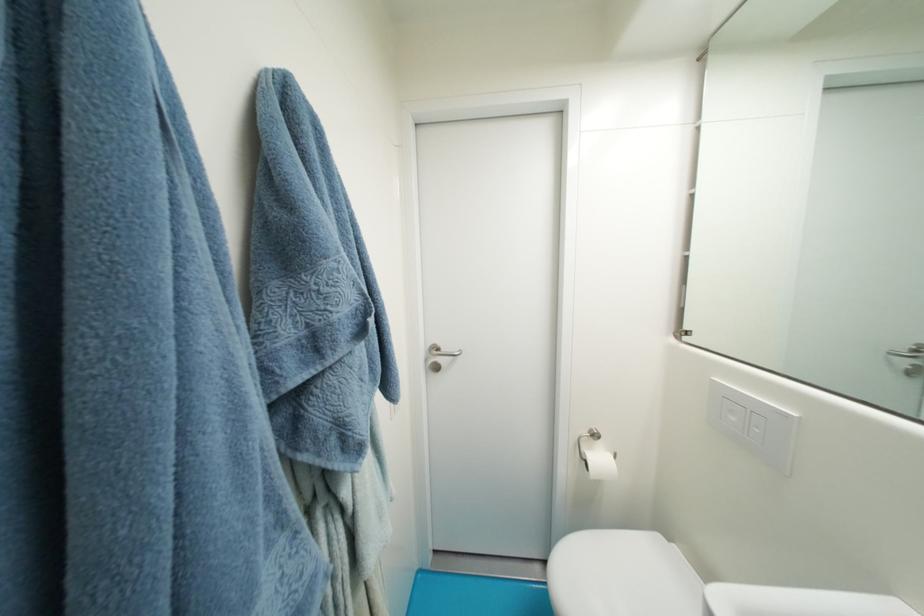
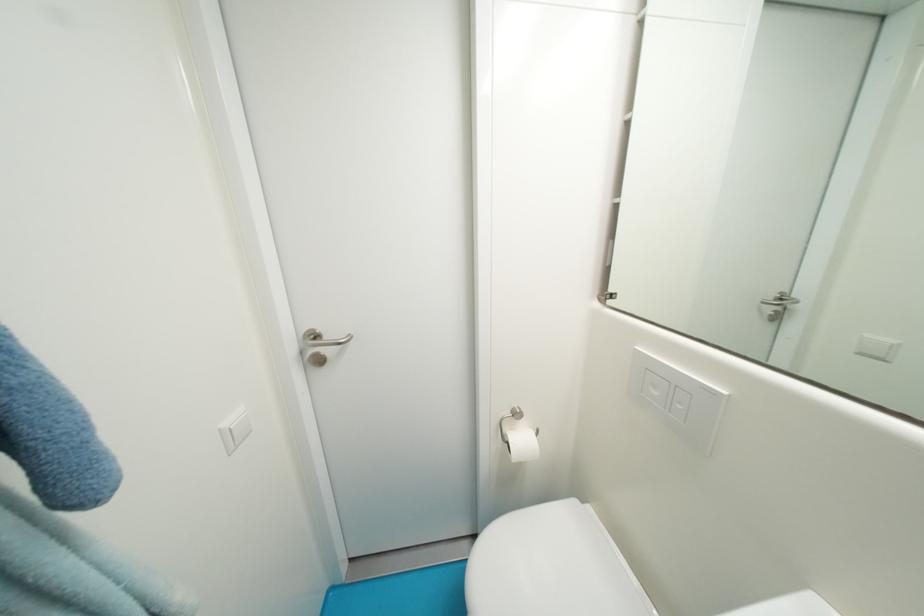
The images are taken continuously from a first-person perspective. In which direction are you moving?

The movement direction of the cameraman is right, forward.